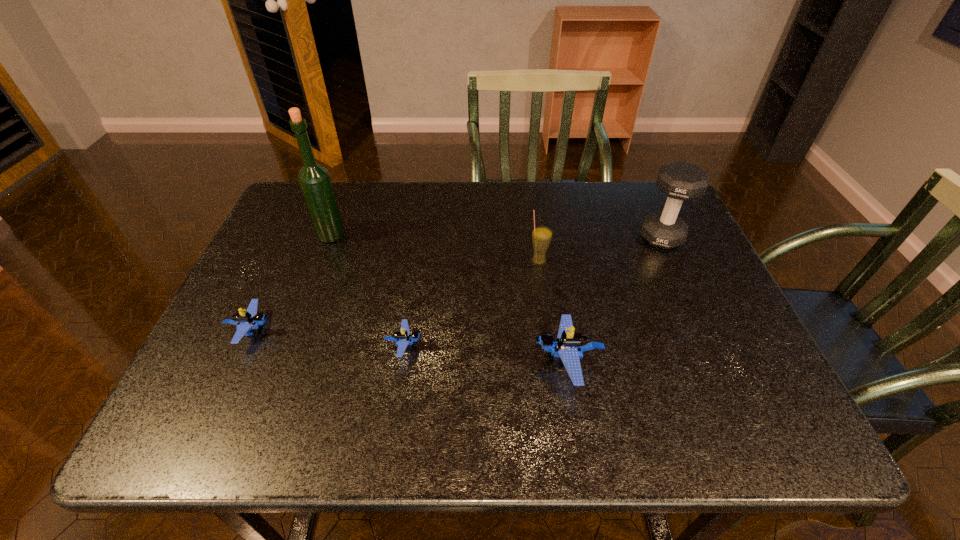
This screenshot has height=540, width=960. Find the location of `free spot at the right edge of the desktop`. free spot at the right edge of the desktop is located at coordinates (703, 278).

Locate an element on the screen. Image resolution: width=960 pixels, height=540 pixels. vacant space at the far right corner is located at coordinates (659, 195).

Find the location of a particular element. free space between the fifth tallest object and the straw for drinking is located at coordinates click(396, 296).

Find the location of `free spot between the third farthest object and the rightmost object`. free spot between the third farthest object and the rightmost object is located at coordinates (600, 249).

This screenshot has height=540, width=960. Find the location of `free spot between the rightmost Lego and the shortest object`. free spot between the rightmost Lego and the shortest object is located at coordinates (486, 354).

I want to click on empty location between the second Lego from right to left and the leftmost Lego, so click(x=328, y=338).

You are a GUI agent. You are given a task and a screenshot of the screen. Output one action in this format:
    pyautogui.click(x=<x>, y=<y>)
    Task: Click on the free point between the fifth shortest object and the third object from left to right
    
    Given the screenshot: What is the action you would take?
    pyautogui.click(x=533, y=291)

At what (x,y) coordinates should I click in order to perform the action: click on free space between the liquor and the third farthest object. Please return your answer as a coordinate pair (x, y). The width and height of the screenshot is (960, 540). Looking at the image, I should click on (435, 248).

Locate an element on the screen. free space between the dumbbell and the shortest Lego is located at coordinates (533, 291).

Where is `free space between the tallest Lego and the leftmost object`? This screenshot has width=960, height=540. free space between the tallest Lego and the leftmost object is located at coordinates (410, 346).